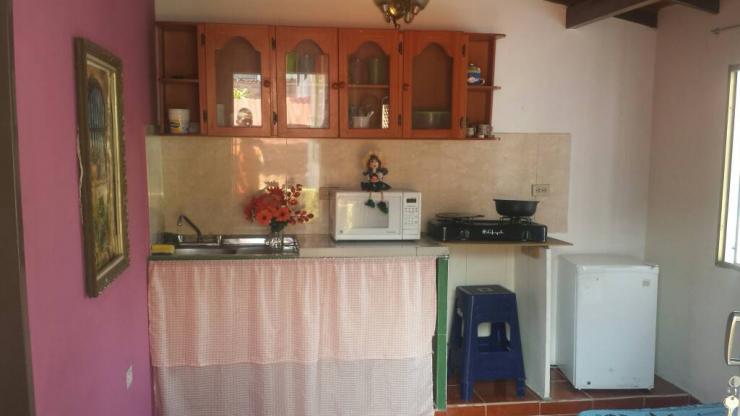
What are the coordinates of `window` in the screenshot? It's located at (729, 243).